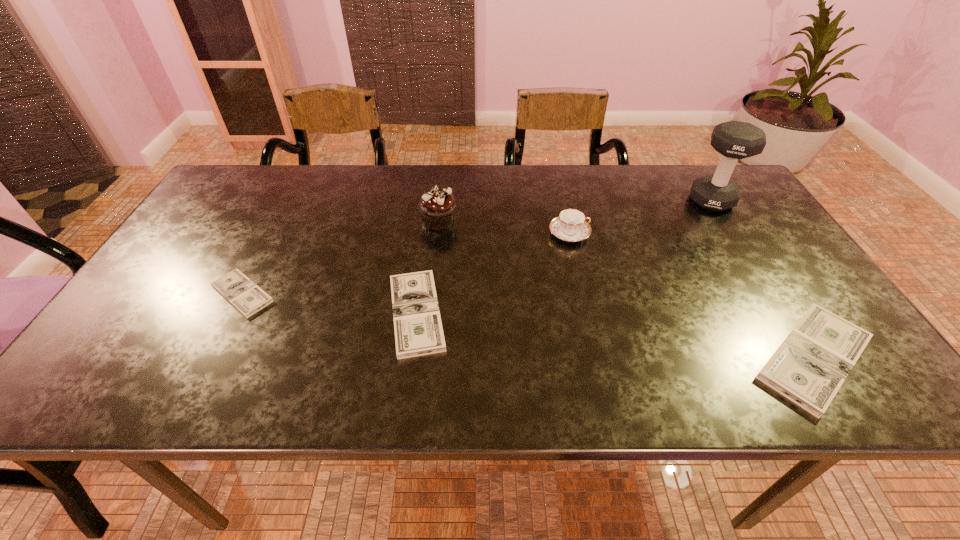
Locate an element on the screen. Image resolution: width=960 pixels, height=540 pixels. the shortest object is located at coordinates (242, 293).

Locate an element on the screen. the shortest dollar is located at coordinates (242, 293).

This screenshot has height=540, width=960. I want to click on the second shortest object, so click(x=418, y=329).

Where is `the second tallest dollar`? Image resolution: width=960 pixels, height=540 pixels. the second tallest dollar is located at coordinates (418, 329).

Find the location of a particular element. The image size is (960, 540). the rightmost dollar is located at coordinates (809, 367).

Locate an element on the screen. The height and width of the screenshot is (540, 960). the tallest object is located at coordinates (735, 140).

Where is `cupcake`? cupcake is located at coordinates (437, 207).

This screenshot has width=960, height=540. What are the coordinates of `teacup` in the screenshot? It's located at click(571, 226).

Find the location of a particular element. The width and height of the screenshot is (960, 540). the third tallest object is located at coordinates (571, 226).

You are a GUI agent. You are given a task and a screenshot of the screen. Output one action in this format:
    pyautogui.click(x=<x>, y=<y>)
    Task: Click on the free space located on the left of the leftmost dollar
    Image resolution: width=960 pixels, height=540 pixels.
    Given the screenshot: What is the action you would take?
    pyautogui.click(x=165, y=294)